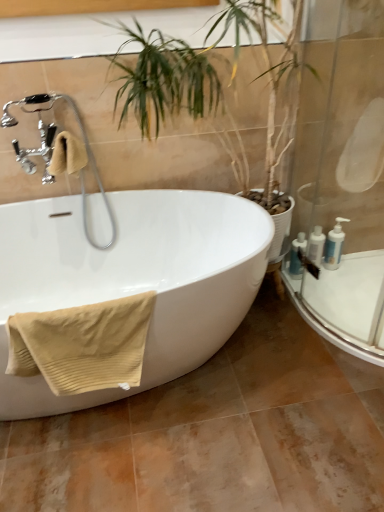
Question: Considering their positions, is chrome/metallic faucet at upper left located in front of or behind white glossy bathtub at center?

Choices:
 (A) behind
 (B) front

Answer: (A)

Question: Would you say chrome/metallic faucet at upper left is inside or outside white glossy bathtub at center?

Choices:
 (A) inside
 (B) outside

Answer: (A)

Question: Which object is the farthest from the white glossy bathtub at center?

Choices:
 (A) white glossy bottle at right, which is the 2th toiletry in right-to-left order
 (B) beige ribbed towel at left, the 1th bath towel from the back
 (C) green leafy plant at center
 (D) beige ribbed towel at lower left, which is the first bath towel from bottom to top
 (E) white glossy bottles at right, the third toiletry from the right

Answer: (A)

Question: Considering the real-world distances, which object is closest to the white glossy bathtub at center?

Choices:
 (A) chrome/metallic faucet at upper left
 (B) white glossy bottle at right, which is the 2th toiletry in right-to-left order
 (C) white glossy bottles at right, placed as the first toiletry when sorted from left to right
 (D) white glossy pump bottles at right, positioned as the first toiletry in right-to-left order
 (E) beige ribbed towel at lower left, which ranks as the 2th bath towel in top-to-bottom order

Answer: (E)